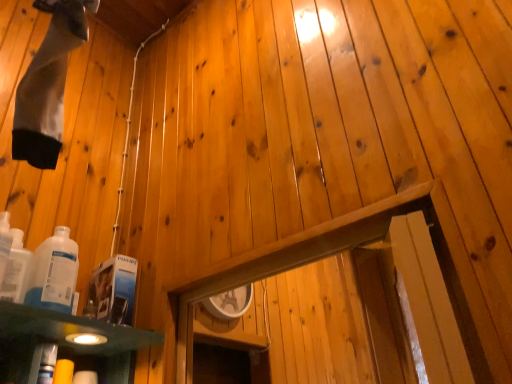
This screenshot has height=384, width=512. What do you see at coordinates (16, 270) in the screenshot?
I see `white glossy bottle at lower left, which appears as the second bottle when viewed from the right` at bounding box center [16, 270].

What is the approximate width of white glossy bottle at lower left, placed as the 1th bottle when sorted from left to right?

It is 2.87 inches.

You are a GUI agent. You are given a task and a screenshot of the screen. Output one action in this format:
    pyautogui.click(x=<x>, y=<y>)
    Task: Click on the white glossy bottle at lower left, placed as the 1th bottle when sorted from left to right
    This screenshot has height=384, width=512.
    Given the screenshot: What is the action you would take?
    (16, 270)

The width and height of the screenshot is (512, 384). What do you see at coordinates (54, 273) in the screenshot?
I see `white glossy bottle at lower left, the second bottle in the left-to-right sequence` at bounding box center [54, 273].

Image resolution: width=512 pixels, height=384 pixels. What are the coordinates of `white glossy bottle at lower left, which is the 1th bottle in right-to-left order` in the screenshot? It's located at (54, 273).

Where is `white glossy bottle at lower left, which appears as the second bottle when viewed from the right`? white glossy bottle at lower left, which appears as the second bottle when viewed from the right is located at coordinates (16, 270).

Is white glossy bottle at lower left, which is the 1th bottle in right-to-left order, to the left of white glossy bottle at lower left, which appears as the second bottle when viewed from the right, from the viewer's perspective?

No, white glossy bottle at lower left, which is the 1th bottle in right-to-left order, is not to the left of white glossy bottle at lower left, which appears as the second bottle when viewed from the right.

Does white glossy bottle at lower left, the second bottle in the left-to-right sequence, lie behind white glossy bottle at lower left, which appears as the second bottle when viewed from the right?

Yes, white glossy bottle at lower left, the second bottle in the left-to-right sequence, is further from the viewer.

Is point (67, 227) less distant than point (17, 266)?

No, (67, 227) is behind (17, 266).

From the image's perspective, between white glossy bottle at lower left, the second bottle in the left-to-right sequence, and white glossy bottle at lower left, which appears as the second bottle when viewed from the right, who is located below?

From the image's view, white glossy bottle at lower left, the second bottle in the left-to-right sequence, is below.

From a real-world perspective, is white glossy bottle at lower left, which is the 1th bottle in right-to-left order, physically above white glossy bottle at lower left, placed as the 1th bottle when sorted from left to right?

Incorrect, from a real-world perspective, white glossy bottle at lower left, which is the 1th bottle in right-to-left order, is lower than white glossy bottle at lower left, placed as the 1th bottle when sorted from left to right.

Between white glossy bottle at lower left, which is the 1th bottle in right-to-left order, and white glossy bottle at lower left, placed as the 1th bottle when sorted from left to right, which one has smaller width?

With smaller width is white glossy bottle at lower left, placed as the 1th bottle when sorted from left to right.

Can you confirm if white glossy bottle at lower left, which is the 1th bottle in right-to-left order, is taller than white glossy bottle at lower left, placed as the 1th bottle when sorted from left to right?

Yes, white glossy bottle at lower left, which is the 1th bottle in right-to-left order, is taller than white glossy bottle at lower left, placed as the 1th bottle when sorted from left to right.

Does white glossy bottle at lower left, the second bottle in the left-to-right sequence, have a smaller size compared to white glossy bottle at lower left, placed as the 1th bottle when sorted from left to right?

Incorrect, white glossy bottle at lower left, the second bottle in the left-to-right sequence, is not smaller in size than white glossy bottle at lower left, placed as the 1th bottle when sorted from left to right.

Looking at this image, does white glossy bottle at lower left, the second bottle in the left-to-right sequence, contain white glossy bottle at lower left, placed as the 1th bottle when sorted from left to right?

Definitely not — white glossy bottle at lower left, placed as the 1th bottle when sorted from left to right, is not inside white glossy bottle at lower left, the second bottle in the left-to-right sequence.

Is white glossy bottle at lower left, the second bottle in the left-to-right sequence, not near white glossy bottle at lower left, placed as the 1th bottle when sorted from left to right?

white glossy bottle at lower left, the second bottle in the left-to-right sequence, is near white glossy bottle at lower left, placed as the 1th bottle when sorted from left to right, not far away.

Is white glossy bottle at lower left, which is the 1th bottle in right-to-left order, oriented away from white glossy bottle at lower left, which appears as the second bottle when viewed from the right?

white glossy bottle at lower left, which is the 1th bottle in right-to-left order, is not turned away from white glossy bottle at lower left, which appears as the second bottle when viewed from the right.

What's the angular difference between white glossy bottle at lower left, the second bottle in the left-to-right sequence, and white glossy bottle at lower left, which appears as the second bottle when viewed from the right,'s facing directions?

The angle between the facing direction of white glossy bottle at lower left, the second bottle in the left-to-right sequence, and the facing direction of white glossy bottle at lower left, which appears as the second bottle when viewed from the right, is 0.00113 degrees.

At what (x,y) coordinates should I click in order to perform the action: click on bottle that appears on the left of white glossy bottle at lower left, which is the 1th bottle in right-to-left order. Please return your answer as a coordinate pair (x, y). Image resolution: width=512 pixels, height=384 pixels. Looking at the image, I should click on (16, 270).

Which object is positioned more to the left, white glossy bottle at lower left, placed as the 1th bottle when sorted from left to right, or white glossy bottle at lower left, the second bottle in the left-to-right sequence?

Positioned to the left is white glossy bottle at lower left, placed as the 1th bottle when sorted from left to right.

Which is in front, white glossy bottle at lower left, placed as the 1th bottle when sorted from left to right, or white glossy bottle at lower left, which is the 1th bottle in right-to-left order?

white glossy bottle at lower left, placed as the 1th bottle when sorted from left to right, is in front.

Considering the positions of point (6, 276) and point (54, 278), is point (6, 276) closer or farther from the camera than point (54, 278)?

Point (6, 276) is closer to the camera than point (54, 278).

From the image's perspective, is white glossy bottle at lower left, which appears as the second bottle when viewed from the right, below white glossy bottle at lower left, the second bottle in the left-to-right sequence?

Incorrect, from the image's perspective, white glossy bottle at lower left, which appears as the second bottle when viewed from the right, is higher than white glossy bottle at lower left, the second bottle in the left-to-right sequence.

From a real-world perspective, who is located lower, white glossy bottle at lower left, which appears as the second bottle when viewed from the right, or white glossy bottle at lower left, the second bottle in the left-to-right sequence?

In real-world perspective, white glossy bottle at lower left, the second bottle in the left-to-right sequence, is lower.

From the picture: Is white glossy bottle at lower left, placed as the 1th bottle when sorted from left to right, wider or thinner than white glossy bottle at lower left, the second bottle in the left-to-right sequence?

Considering their sizes, white glossy bottle at lower left, placed as the 1th bottle when sorted from left to right, looks slimmer than white glossy bottle at lower left, the second bottle in the left-to-right sequence.

Between white glossy bottle at lower left, which appears as the second bottle when viewed from the right, and white glossy bottle at lower left, the second bottle in the left-to-right sequence, which one has less height?

Standing shorter between the two is white glossy bottle at lower left, which appears as the second bottle when viewed from the right.

Does white glossy bottle at lower left, placed as the 1th bottle when sorted from left to right, have a larger size compared to white glossy bottle at lower left, which is the 1th bottle in right-to-left order?

No, white glossy bottle at lower left, placed as the 1th bottle when sorted from left to right, is not bigger than white glossy bottle at lower left, which is the 1th bottle in right-to-left order.

Based on the photo, does white glossy bottle at lower left, placed as the 1th bottle when sorted from left to right, contain white glossy bottle at lower left, which is the 1th bottle in right-to-left order?

No, white glossy bottle at lower left, which is the 1th bottle in right-to-left order, is not surrounded by white glossy bottle at lower left, placed as the 1th bottle when sorted from left to right.

Is white glossy bottle at lower left, which appears as the second bottle when viewed from the right, beside white glossy bottle at lower left, which is the 1th bottle in right-to-left order?

Yes, white glossy bottle at lower left, which appears as the second bottle when viewed from the right, is touching white glossy bottle at lower left, which is the 1th bottle in right-to-left order.

Is white glossy bottle at lower left, the second bottle in the left-to-right sequence, at the back of white glossy bottle at lower left, which appears as the second bottle when viewed from the right?

white glossy bottle at lower left, which appears as the second bottle when viewed from the right, is not turned away from white glossy bottle at lower left, the second bottle in the left-to-right sequence.

What's the angular difference between white glossy bottle at lower left, placed as the 1th bottle when sorted from left to right, and white glossy bottle at lower left, which is the 1th bottle in right-to-left order,'s facing directions?

They differ by 0.00113 degrees in their facing directions.

Could you measure the distance between white glossy bottle at lower left, placed as the 1th bottle when sorted from left to right, and white glossy bottle at lower left, the second bottle in the left-to-right sequence?

2.00 inches.

Image resolution: width=512 pixels, height=384 pixels. I want to click on bottle located behind the white glossy bottle at lower left, placed as the 1th bottle when sorted from left to right, so click(54, 273).

Locate an element on the screen. This screenshot has height=384, width=512. bottle below the white glossy bottle at lower left, placed as the 1th bottle when sorted from left to right (from a real-world perspective) is located at coordinates (54, 273).

Where is `bottle behind the white glossy bottle at lower left, placed as the 1th bottle when sorted from left to right`? This screenshot has width=512, height=384. bottle behind the white glossy bottle at lower left, placed as the 1th bottle when sorted from left to right is located at coordinates (54, 273).